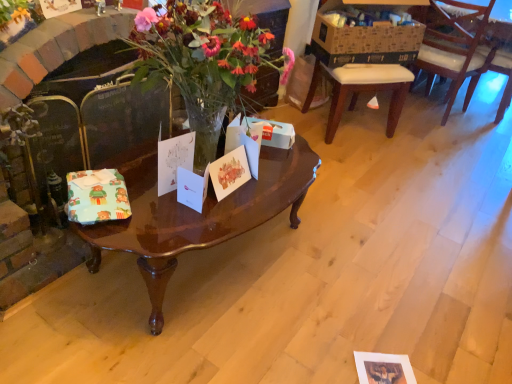
The image size is (512, 384). I want to click on vacant space that is in between brightly colored paper at center, which is the 1th gift card in left-to-right order, and white paper gift card at center, arranged as the third gift card when viewed from the right, so point(143,194).